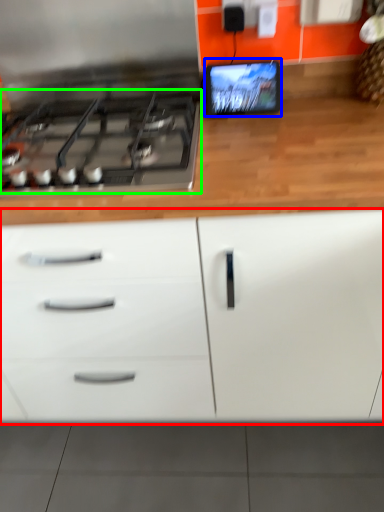
Question: Which object is the closest to the cabinetry (highlighted by a red box)? Choose among these: computer monitor (highlighted by a blue box) or gas stove (highlighted by a green box).

Choices:
 (A) computer monitor
 (B) gas stove

Answer: (B)